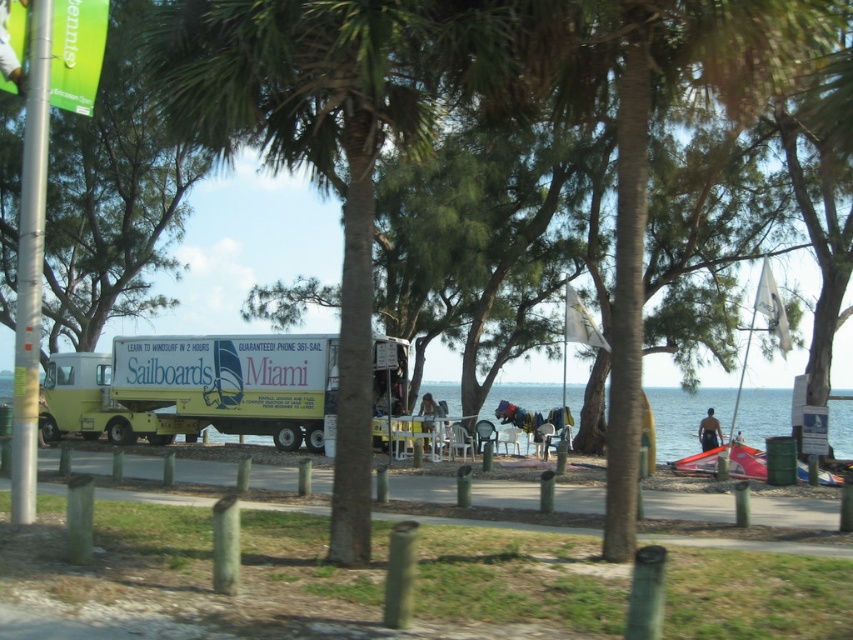
Looking at this image, you are standing at the center of the paved pathway and want to reach the clear blue water at lower center. According to the coordinates provided, in which direction should you walk to reach it?

The clear blue water at lower center is located at coordinates point (685,417). Since the coordinate system is not specified, but assuming standard image coordinates where the origin is at the top left corner, the x increases to the right and y increases downward. Therefore, to reach the clear blue water at lower center from the center of the pathway, you should walk towards the lower right direction.

You are a delivery drone flying at a height of 5 meters above the yellow matte food truck at center. Can you see the clear blue water at lower center from your current position?

The yellow matte food truck at center is shorter than the clear blue water at lower center, so yes, the drone can see the clear blue water at lower center from its current position.